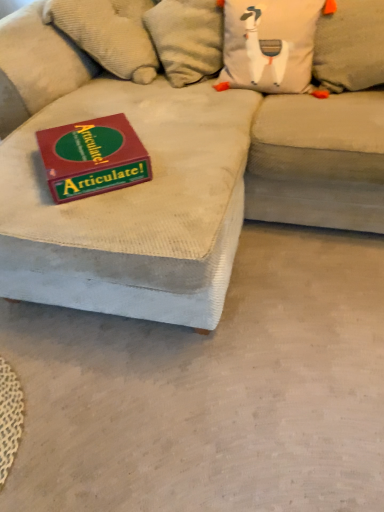
Question: Can you confirm if gray fabric pillow at upper right, the 2th pillow in the left-to-right sequence, is thinner than beige corduroy couch at center?

Choices:
 (A) yes
 (B) no

Answer: (A)

Question: Is gray fabric pillow at upper right, the 2th pillow in the left-to-right sequence, oriented towards beige corduroy couch at center?

Choices:
 (A) yes
 (B) no

Answer: (A)

Question: Can you confirm if gray fabric pillow at upper right, the first pillow when ordered from right to left, is taller than beige corduroy couch at center?

Choices:
 (A) yes
 (B) no

Answer: (B)

Question: Is gray fabric pillow at upper right, the first pillow when ordered from right to left, outside of beige corduroy couch at center?

Choices:
 (A) yes
 (B) no

Answer: (B)

Question: Can you confirm if gray fabric pillow at upper right, the 2th pillow in the left-to-right sequence, is smaller than beige corduroy couch at center?

Choices:
 (A) yes
 (B) no

Answer: (A)

Question: Is beige corduroy couch at center taller or shorter than matte red box at upper left?

Choices:
 (A) short
 (B) tall

Answer: (B)

Question: Based on their sizes in the image, would you say beige corduroy couch at center is bigger or smaller than matte red box at upper left?

Choices:
 (A) small
 (B) big

Answer: (B)

Question: From a real-world perspective, relative to matte red box at upper left, is beige corduroy couch at center vertically above or below?

Choices:
 (A) below
 (B) above

Answer: (A)

Question: In terms of width, does beige corduroy couch at center look wider or thinner when compared to matte red box at upper left?

Choices:
 (A) wide
 (B) thin

Answer: (A)

Question: From a real-world perspective, is matte red box at upper left above or below gray fabric pillow at upper right, the first pillow when ordered from right to left?

Choices:
 (A) below
 (B) above

Answer: (A)

Question: Based on their positions, is matte red box at upper left located to the left or right of gray fabric pillow at upper right, the 2th pillow in the left-to-right sequence?

Choices:
 (A) right
 (B) left

Answer: (B)

Question: In terms of height, does matte red box at upper left look taller or shorter compared to gray fabric pillow at upper right, the first pillow when ordered from right to left?

Choices:
 (A) tall
 (B) short

Answer: (B)

Question: Considering the positions of matte red box at upper left and gray fabric pillow at upper right, the first pillow when ordered from right to left, in the image, is matte red box at upper left wider or thinner than gray fabric pillow at upper right, the first pillow when ordered from right to left,?

Choices:
 (A) thin
 (B) wide

Answer: (B)

Question: Would you say matte red box at upper left is to the left or to the right of white fabric pillow at upper center, which is counted as the 1th pillow, starting from the left, in the picture?

Choices:
 (A) right
 (B) left

Answer: (B)

Question: From a real-world perspective, relative to white fabric pillow at upper center, the second pillow in the right-to-left sequence, is matte red box at upper left vertically above or below?

Choices:
 (A) above
 (B) below

Answer: (B)